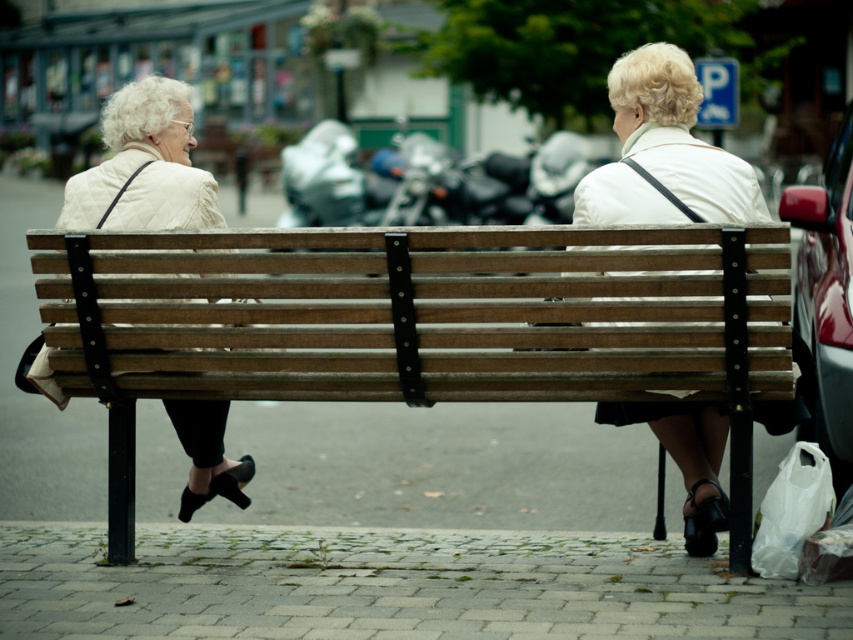
Can you confirm if white fabric jacket at center is shorter than metallic red car at right?

Yes, white fabric jacket at center is shorter than metallic red car at right.

Can you confirm if white fabric jacket at center is wider than metallic red car at right?

In fact, white fabric jacket at center might be narrower than metallic red car at right.

Locate an element on the screen. This screenshot has height=640, width=853. white fabric jacket at center is located at coordinates (663, 152).

Is point (206, 448) behind point (840, 387)?

No, it is in front of (840, 387).

Where is `white quilted jacket at left`? white quilted jacket at left is located at coordinates (144, 166).

Between wooden bench at center and white quilted jacket at left, which one appears on the right side from the viewer's perspective?

wooden bench at center is more to the right.

Who is more distant from viewer, (100, 241) or (91, 198)?

Point (91, 198)

The width and height of the screenshot is (853, 640). In order to click on wooden bench at center in this screenshot , I will do `click(419, 323)`.